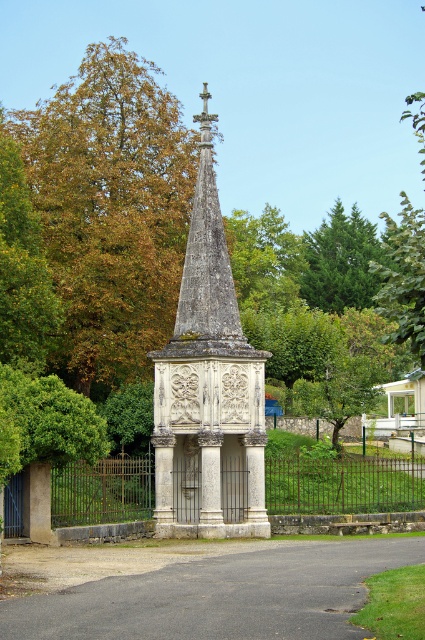
You are planning to install a new pathway between the brown metal fence at center and the green coniferous tree at upper right. Based on their widths, which object should you consider for the pathway design to ensure enough space?

The brown metal fence at center is wider than the green coniferous tree at upper right, so the pathway should be designed around the brown metal fence at center to accommodate its greater width.

You are standing in the outdoor area and want to take a photo of the green coniferous tree at upper right. To avoid including the brown metal fence at center in your photo, should you move to the left or the right of the tree?

The brown metal fence at center is positioned on the left side of the green coniferous tree at upper right. To avoid including the fence, you should move to the right of the tree.